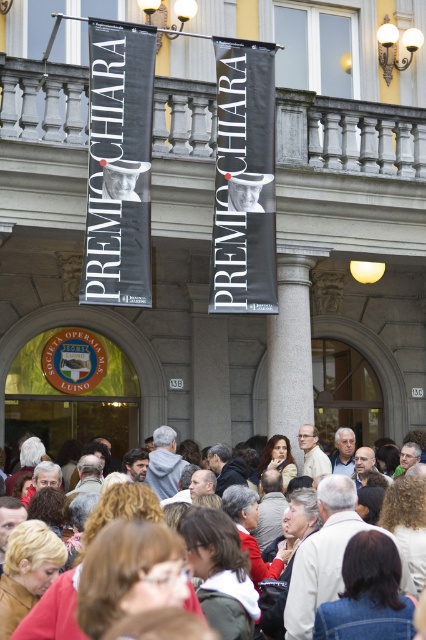
In the scene shown: You are a photographer planning to take a group photo of the crowd in front of the classical building. You want to ensure that both the black fabric banner at center and the gray marble pillar at center are fully visible in the frame. Based on their sizes, which object should you position closer to the edge of the frame to avoid overcrowding the composition?

The black fabric banner at center might be wider than the gray marble pillar at center, so positioning the gray marble pillar at center closer to the edge of the frame would help avoid overcrowding since it is likely narrower.

You are standing in front of the classical building and see the point marked at coordinates (118, 163). What object is located at that position?

The point at coordinates (118, 163) marks the location of the black matte banner at upper left.

Looking at this image, you are a photographer standing in front of the classical building and want to take a photo that includes both the black fabric banner at center and the gray marble pillar at center. Which object should you position closer to the top of your camera frame?

The black fabric banner at center is above the gray marble pillar at center, so you should position the black fabric banner at center closer to the top of your camera frame.